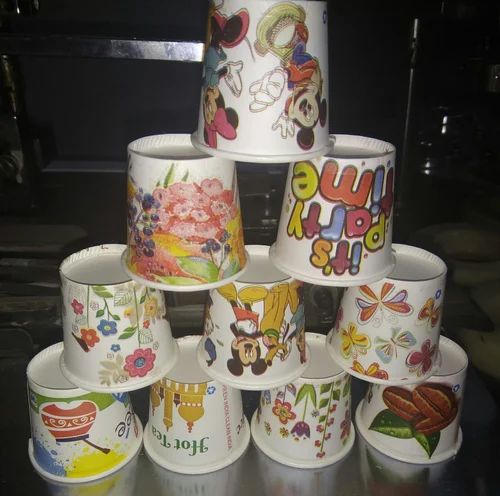
Where is `upside down white disposable cups with decorations`? This screenshot has height=496, width=500. upside down white disposable cups with decorations is located at coordinates coord(97,426), coord(215,423), coord(303,411), coord(413,413), coord(403,322), coord(270,330), coord(133,308), coord(189,211), coord(323,206), coord(263,62).